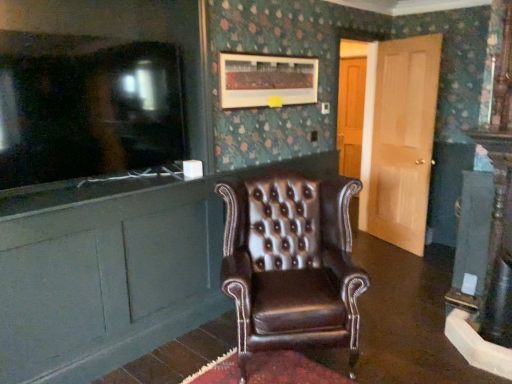
Question: Does brown leather cabinet at left come in front of brown leather wingback chair at center?

Choices:
 (A) no
 (B) yes

Answer: (B)

Question: Are brown leather cabinet at left and brown leather wingback chair at center located far from each other?

Choices:
 (A) no
 (B) yes

Answer: (A)

Question: From the image's perspective, is brown leather cabinet at left beneath brown leather wingback chair at center?

Choices:
 (A) no
 (B) yes

Answer: (A)

Question: Does brown leather cabinet at left have a larger size compared to brown leather wingback chair at center?

Choices:
 (A) no
 (B) yes

Answer: (A)

Question: Is brown leather wingback chair at center at the back of brown leather cabinet at left?

Choices:
 (A) no
 (B) yes

Answer: (B)

Question: From a real-world perspective, is brown leather cabinet at left over brown leather wingback chair at center?

Choices:
 (A) yes
 (B) no

Answer: (A)

Question: Considering the relative sizes of matte black television at left and wooden picture frame at upper center in the image provided, is matte black television at left smaller than wooden picture frame at upper center?

Choices:
 (A) yes
 (B) no

Answer: (B)

Question: From the image's perspective, does matte black television at left appear higher than wooden picture frame at upper center?

Choices:
 (A) yes
 (B) no

Answer: (B)

Question: From a real-world perspective, does matte black television at left sit lower than wooden picture frame at upper center?

Choices:
 (A) yes
 (B) no

Answer: (A)

Question: Is matte black television at left next to wooden picture frame at upper center?

Choices:
 (A) no
 (B) yes

Answer: (A)

Question: Is matte black television at left shorter than wooden picture frame at upper center?

Choices:
 (A) yes
 (B) no

Answer: (B)

Question: Can you confirm if matte black television at left is thinner than wooden picture frame at upper center?

Choices:
 (A) no
 (B) yes

Answer: (A)

Question: Can you confirm if brown leather wingback chair at center is thinner than brown leather cabinet at left?

Choices:
 (A) no
 (B) yes

Answer: (A)